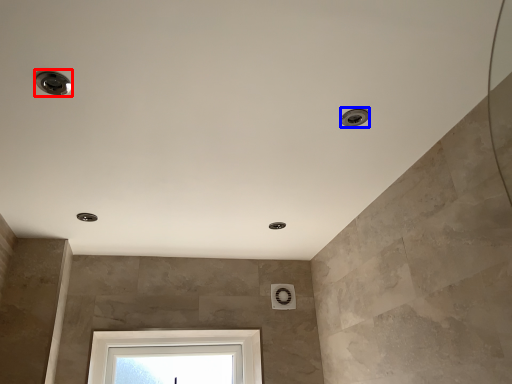
Question: Which point is closer to the camera, droplight (highlighted by a red box) or droplight (highlighted by a blue box)?

Choices:
 (A) droplight
 (B) droplight

Answer: (A)